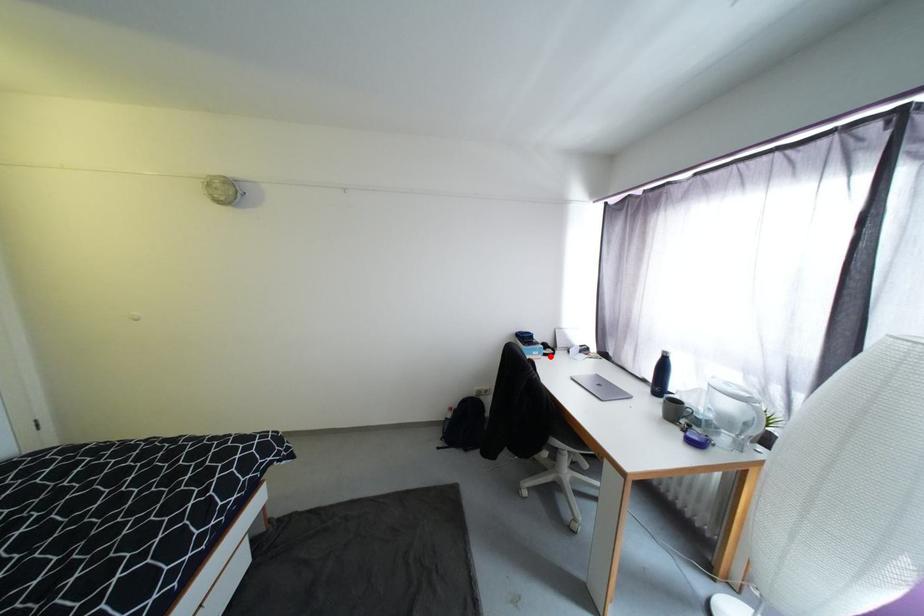
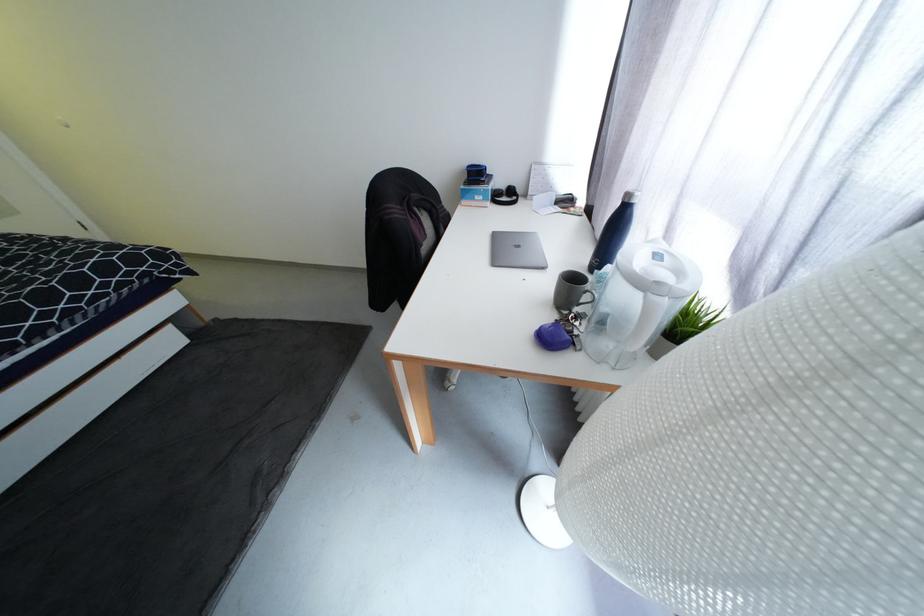
The point at the highlighted location is marked in the first image. Where is the corresponding point in the second image?

(499, 203)